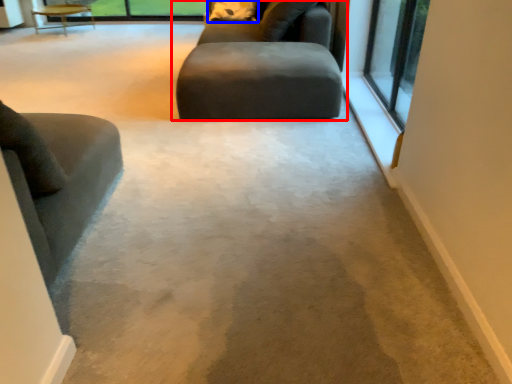
Question: Which object appears farthest to the camera in this image, studio couch (highlighted by a red box) or pillow (highlighted by a blue box)?

Choices:
 (A) studio couch
 (B) pillow

Answer: (B)